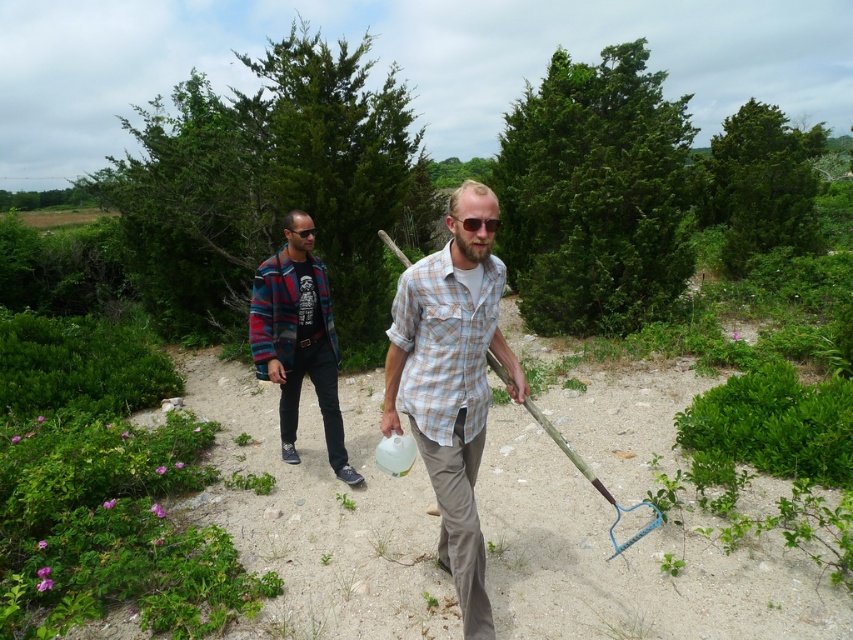
Which is more to the left, plaid cotton shirt at center or plaid wool jacket at left?

From the viewer's perspective, plaid wool jacket at left appears more on the left side.

Identify the location of plaid cotton shirt at center. The image size is (853, 640). (451, 381).

This screenshot has width=853, height=640. What do you see at coordinates (451, 381) in the screenshot? I see `plaid cotton shirt at center` at bounding box center [451, 381].

You are a GUI agent. You are given a task and a screenshot of the screen. Output one action in this format:
    pyautogui.click(x=<x>, y=<y>)
    Task: Click on the plaid cotton shirt at center
    
    Given the screenshot: What is the action you would take?
    pyautogui.click(x=451, y=381)